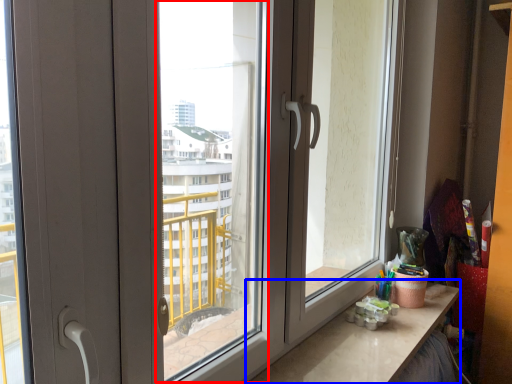
Question: Which object appears farthest to the camera in this image, window screen (highlighted by a red box) or counter top (highlighted by a blue box)?

Choices:
 (A) window screen
 (B) counter top

Answer: (B)